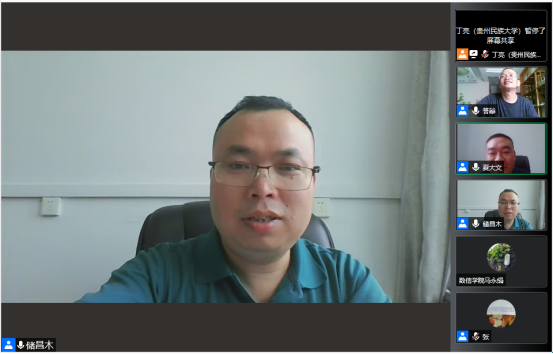
What are the coordinates of `curtains` in the screenshot? It's located at (432, 216).